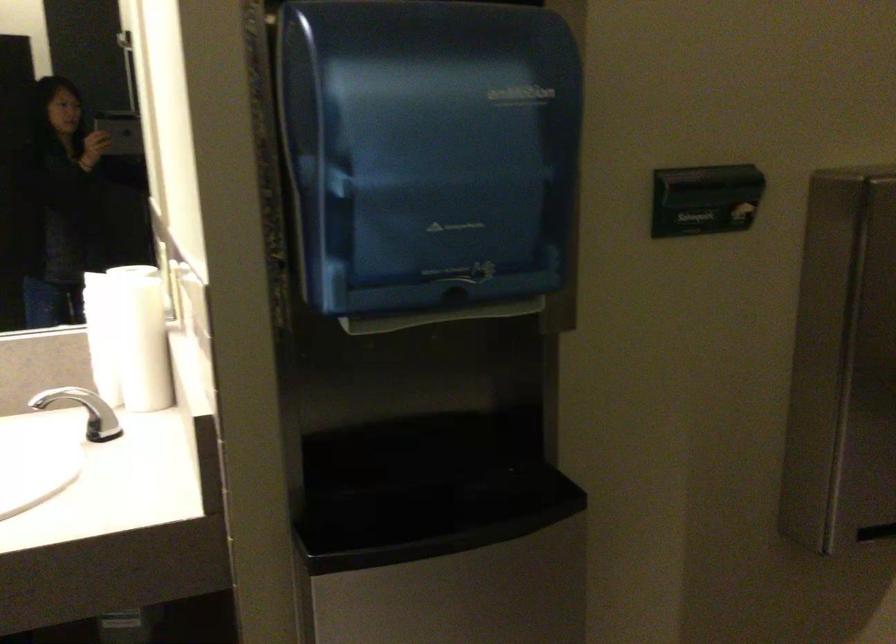
You are a GUI agent. You are given a task and a screenshot of the screen. Output one action in this format:
    pyautogui.click(x=<x>, y=<y>)
    Task: Click on the dispensed paper towel
    This screenshot has width=896, height=644.
    Given the screenshot: What is the action you would take?
    pyautogui.click(x=432, y=160)